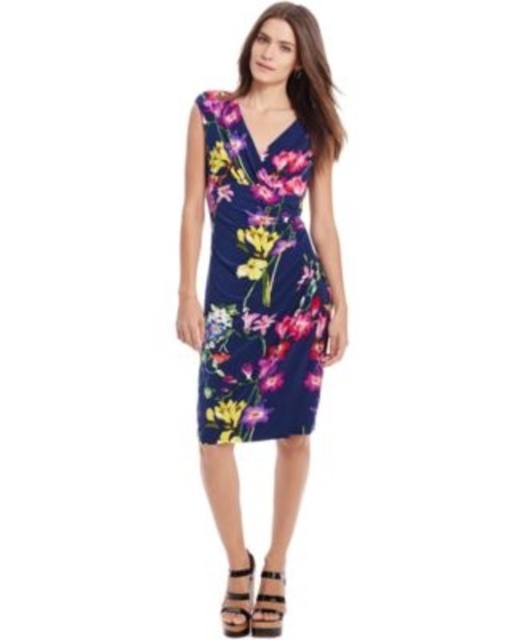
This screenshot has width=525, height=640. What do you see at coordinates (262, 266) in the screenshot? I see `floral print dress at center` at bounding box center [262, 266].

Where is `floral print dress at center`? floral print dress at center is located at coordinates (262, 266).

Is floral print jersey dress at center smaller than matte black sandal at lower center?

No, floral print jersey dress at center is not smaller than matte black sandal at lower center.

Which is more to the left, floral print jersey dress at center or matte black sandal at lower center?

From the viewer's perspective, matte black sandal at lower center appears more on the left side.

Who is more distant from viewer, (308, 426) or (222, 621)?

The point (222, 621) is behind.

This screenshot has height=640, width=525. I want to click on floral print jersey dress at center, so click(x=258, y=284).

Does point (247, 369) come farther from viewer compared to point (266, 611)?

No.

Who is positioned more to the right, floral print dress at center or black leather sandal at lower center?

black leather sandal at lower center is more to the right.

At what (x,y) coordinates should I click in order to perform the action: click on floral print dress at center. Please return your answer as a coordinate pair (x, y). The height and width of the screenshot is (640, 525). Looking at the image, I should click on (262, 266).